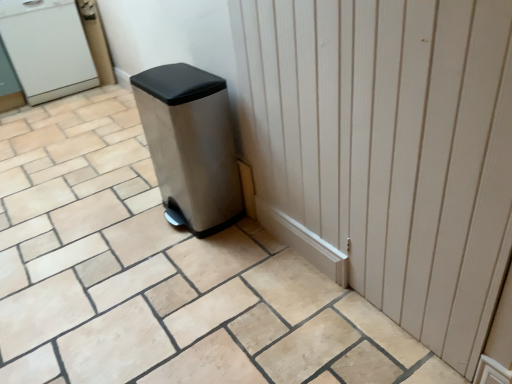
What do you see at coordinates (191, 145) in the screenshot? The height and width of the screenshot is (384, 512). I see `stainless steel trash can at center` at bounding box center [191, 145].

The height and width of the screenshot is (384, 512). Describe the element at coordinates (160, 275) in the screenshot. I see `beige ceramic tile at center` at that location.

Locate an element on the screen. Image resolution: width=512 pixels, height=384 pixels. white wood door at center is located at coordinates (387, 151).

Is white wood door at center facing towards white matte water cooler at upper left?

No.

Is white wood door at center directly adjacent to white matte water cooler at upper left?

No, white wood door at center is not in contact with white matte water cooler at upper left.

Is white wood door at center bigger or smaller than white matte water cooler at upper left?

Clearly, white wood door at center is smaller in size than white matte water cooler at upper left.

Is point (472, 218) farther from viewer compared to point (58, 65)?

That is False.

At what (x,y) coordinates should I click in order to perform the action: click on door above the stainless steel trash can at center (from a real-world perspective). Please return your answer as a coordinate pair (x, y). The image size is (512, 384). Looking at the image, I should click on (387, 151).

Is stainless steel trash can at center placed right next to white wood door at center?

No, stainless steel trash can at center is not beside white wood door at center.

Considering the sizes of stainless steel trash can at center and white wood door at center in the image, is stainless steel trash can at center wider or thinner than white wood door at center?

Considering their sizes, stainless steel trash can at center looks broader than white wood door at center.

Who is bigger, stainless steel trash can at center or white matte water cooler at upper left?

white matte water cooler at upper left.

Considering the positions of point (189, 173) and point (26, 92), is point (189, 173) closer or farther from the camera than point (26, 92)?

Point (189, 173).

From the picture: Is stainless steel trash can at center directly adjacent to white matte water cooler at upper left?

No, stainless steel trash can at center is not beside white matte water cooler at upper left.

From the image's perspective, is beige ceramic tile at center located beneath white matte water cooler at upper left?

Yes, from the image's perspective, beige ceramic tile at center is below white matte water cooler at upper left.

Could you tell me if beige ceramic tile at center is facing white matte water cooler at upper left?

No, beige ceramic tile at center is not turned towards white matte water cooler at upper left.

The height and width of the screenshot is (384, 512). Find the location of `water cooler that appears above the beige ceramic tile at center (from a real-world perspective)`. water cooler that appears above the beige ceramic tile at center (from a real-world perspective) is located at coordinates (47, 48).

Considering the sizes of objects beige ceramic tile at center and white matte water cooler at upper left in the image provided, who is taller, beige ceramic tile at center or white matte water cooler at upper left?

white matte water cooler at upper left is taller.

From a real-world perspective, does beige ceramic tile at center sit lower than stainless steel trash can at center?

Indeed, from a real-world perspective, beige ceramic tile at center is positioned beneath stainless steel trash can at center.

How many degrees apart are the facing directions of beige ceramic tile at center and stainless steel trash can at center?

They differ by 88.2 degrees in their facing directions.

Could you tell me if beige ceramic tile at center is turned towards stainless steel trash can at center?

No, beige ceramic tile at center is not facing towards stainless steel trash can at center.

Which is more to the right, white wood door at center or beige ceramic tile at center?

white wood door at center.

Is white wood door at center located outside beige ceramic tile at center?

Yes, white wood door at center is outside of beige ceramic tile at center.

Is point (417, 26) less distant than point (220, 316)?

Yes, point (417, 26) is in front of point (220, 316).

You are a GUI agent. You are given a task and a screenshot of the screen. Output one action in this format:
    pyautogui.click(x=<x>, y=<y>)
    Task: Click on the ceramic tile that is in front of the white wood door at center
    
    Given the screenshot: What is the action you would take?
    pyautogui.click(x=160, y=275)

Can you tell me how much white matte water cooler at upper left and white wood door at center differ in facing direction?

white matte water cooler at upper left and white wood door at center are facing 88.4 degrees away from each other.

Is white matte water cooler at upper left aimed at white wood door at center?

Yes.

Relative to white wood door at center, is white matte water cooler at upper left in front or behind?

Clearly, white matte water cooler at upper left is behind white wood door at center.

Where is `water cooler on the left side of white wood door at center`? The image size is (512, 384). water cooler on the left side of white wood door at center is located at coordinates (47, 48).

This screenshot has width=512, height=384. I want to click on waste container behind the white wood door at center, so click(191, 145).

Looking at the image, which one is located closer to white matte water cooler at upper left, white wood door at center or beige ceramic tile at center?

Based on the image, beige ceramic tile at center appears to be nearer to white matte water cooler at upper left.

Considering their positions, is white wood door at center positioned further to stainless steel trash can at center than beige ceramic tile at center?

The object further to stainless steel trash can at center is white wood door at center.

Considering their positions, is white matte water cooler at upper left positioned closer to beige ceramic tile at center than white wood door at center?

white wood door at center is closer to beige ceramic tile at center.

Based on the photo, when comparing their distances from beige ceramic tile at center, does white matte water cooler at upper left or stainless steel trash can at center seem closer?

stainless steel trash can at center is positioned closer to the anchor beige ceramic tile at center.

Based on their spatial positions, is stainless steel trash can at center or beige ceramic tile at center further from white wood door at center?

Based on the image, beige ceramic tile at center appears to be further to white wood door at center.

Which object lies further to the anchor point white wood door at center, stainless steel trash can at center or white matte water cooler at upper left?

white matte water cooler at upper left is further to white wood door at center.

Which object lies further to the anchor point white wood door at center, white matte water cooler at upper left or beige ceramic tile at center?

white matte water cooler at upper left.

Estimate the real-world distances between objects in this image. Which object is closer to white matte water cooler at upper left, stainless steel trash can at center or beige ceramic tile at center?

Based on the image, beige ceramic tile at center appears to be nearer to white matte water cooler at upper left.

At what (x,y) coordinates should I click in order to perform the action: click on waste container between beige ceramic tile at center and white wood door at center from left to right. Please return your answer as a coordinate pair (x, y). Looking at the image, I should click on (191, 145).

Find the location of a particular element. This screenshot has height=384, width=512. waste container located between beige ceramic tile at center and white matte water cooler at upper left in the depth direction is located at coordinates (191, 145).

Locate an element on the screen. Image resolution: width=512 pixels, height=384 pixels. waste container positioned between white wood door at center and white matte water cooler at upper left from near to far is located at coordinates (191, 145).

Where is `door between beige ceramic tile at center and white matte water cooler at upper left in the front-back direction`? This screenshot has width=512, height=384. door between beige ceramic tile at center and white matte water cooler at upper left in the front-back direction is located at coordinates (387, 151).